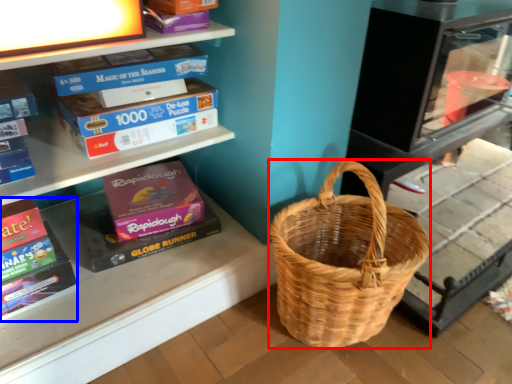
Question: Which object appears closest to the camera in this image, picnic basket (highlighted by a red box) or paperback book (highlighted by a blue box)?

Choices:
 (A) picnic basket
 (B) paperback book

Answer: (A)